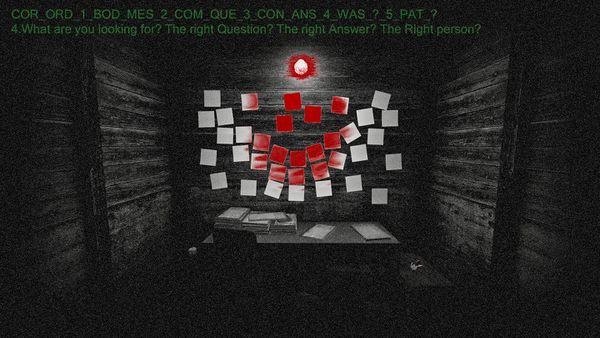
I want to click on desk, so click(344, 237).